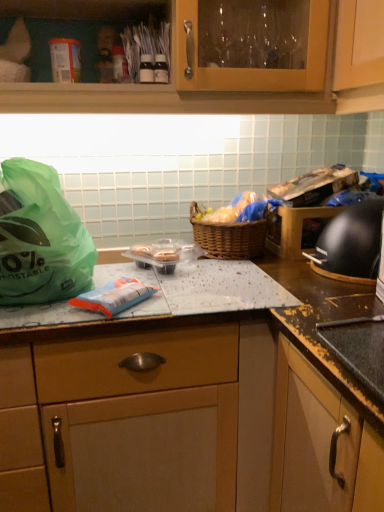
The height and width of the screenshot is (512, 384). I want to click on vacant space in between green plastic bag at left and black matte gas stove at right, so click(x=234, y=282).